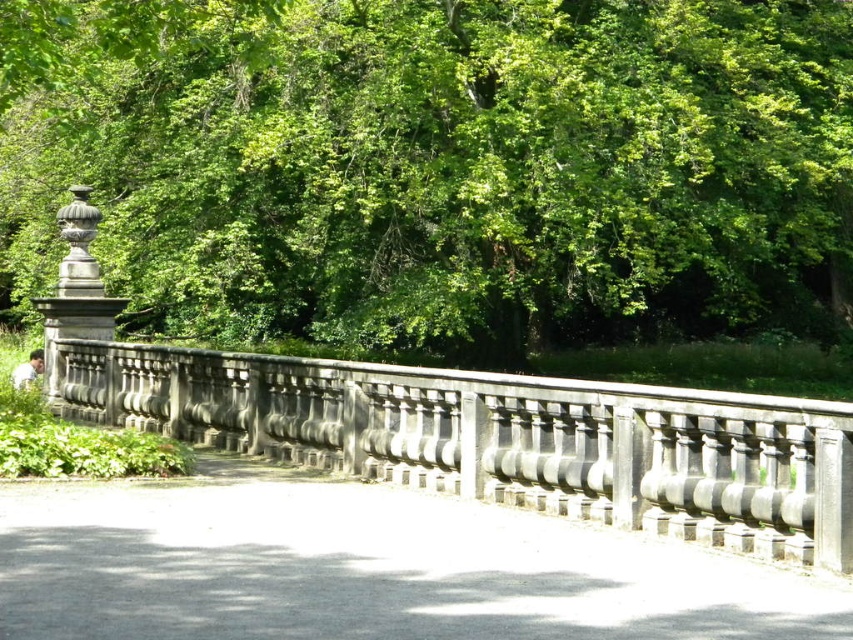
Who is lower down, gray concrete path at center or gray stone fence at center?

Positioned lower is gray concrete path at center.

Which is in front, point (233, 512) or point (448, 420)?

Point (233, 512) is in front.

Does point (252, 500) lie behind point (489, 397)?

No.

Find the location of `gray concrete path at center`. gray concrete path at center is located at coordinates (367, 566).

In the scene shown: Between green leafy tree at upper center and gray concrete path at center, which one appears on the left side from the viewer's perspective?

green leafy tree at upper center

Does green leafy tree at upper center have a lesser width compared to gray concrete path at center?

In fact, green leafy tree at upper center might be wider than gray concrete path at center.

Between point (788, 122) and point (93, 632), which one is positioned in front?

Positioned in front is point (93, 632).

Find the location of a particular element. This screenshot has width=853, height=640. green leafy tree at upper center is located at coordinates (447, 168).

Can you confirm if green leafy tree at upper center is positioned below gray stone fence at center?

No, green leafy tree at upper center is not below gray stone fence at center.

Between point (361, 147) and point (201, 412), which one is positioned behind?

The point (361, 147) is more distant.

Is point (380, 250) farther from camera compared to point (271, 436)?

Yes, it is.

This screenshot has height=640, width=853. I want to click on green leafy tree at upper center, so click(x=447, y=168).